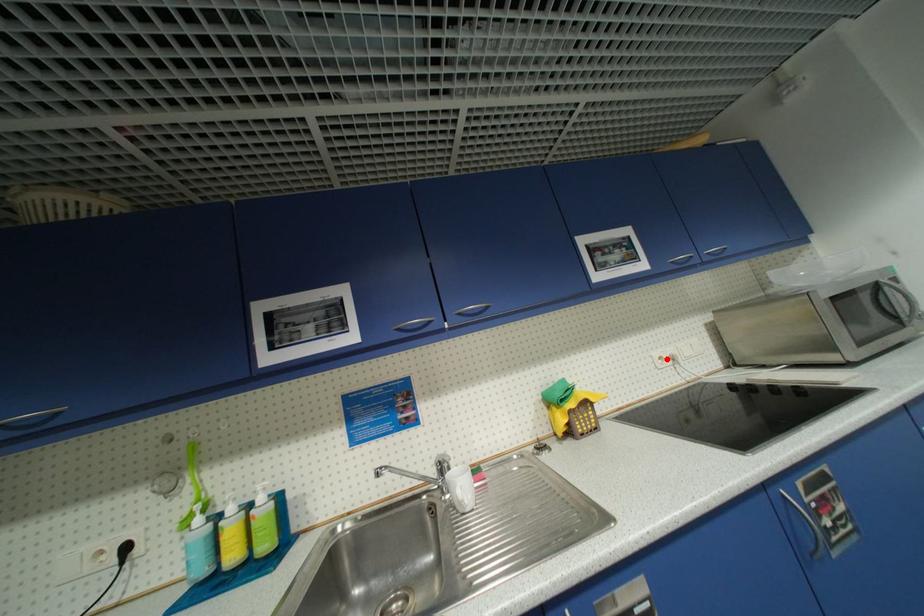
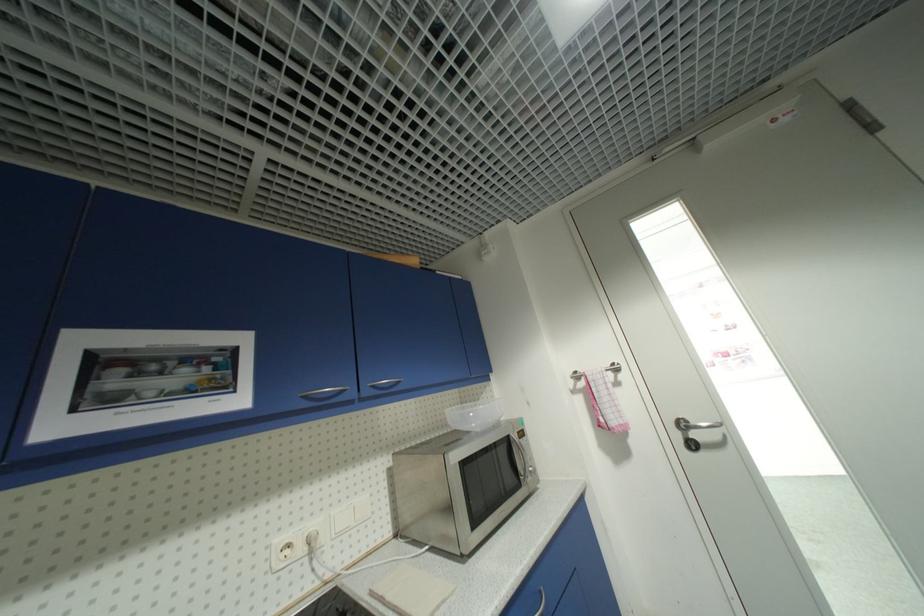
Where in the second image is the point corresponding to the highlighted location from the first image?

(294, 546)